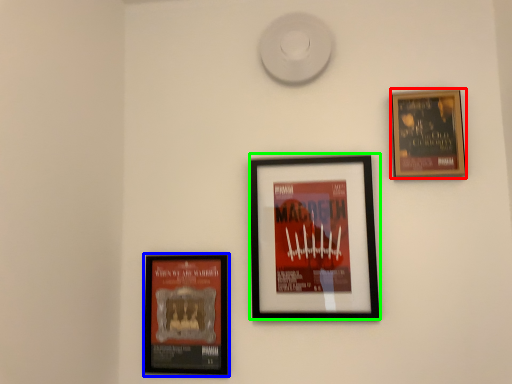
Question: Considering the real-world distances, which object is closest to picture frame (highlighted by a red box)? picture frame (highlighted by a blue box) or picture frame (highlighted by a green box).

Choices:
 (A) picture frame
 (B) picture frame

Answer: (B)